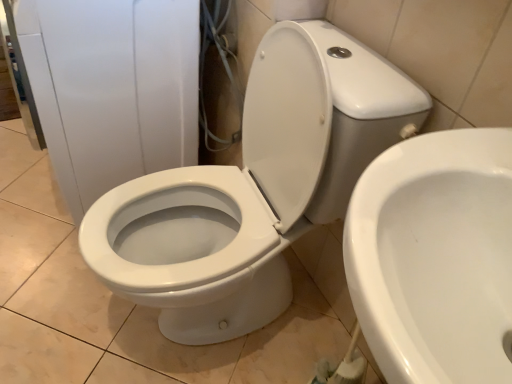
What do you see at coordinates (253, 187) in the screenshot? I see `white glossy toilet at center, which is the 2th toilet from right to left` at bounding box center [253, 187].

How much space does white glossy toilet at center, which ranks as the second toilet in left-to-right order, occupy horizontally?

It is 17.57 inches.

Looking at this image, measure the distance between white glossy toilet at center and camera.

The depth of white glossy toilet at center is 33.75 inches.

Where is `white glossy toilet at center, arranged as the first toilet when viewed from the left`? Image resolution: width=512 pixels, height=384 pixels. white glossy toilet at center, arranged as the first toilet when viewed from the left is located at coordinates (253, 187).

Is point (375, 318) positioned in front of point (173, 290)?

Yes.

Is white glossy toilet at center, the first toilet viewed from the right, to the left or to the right of white glossy toilet at center, which is the 2th toilet from right to left, in the image?

Based on their positions, white glossy toilet at center, the first toilet viewed from the right, is located to the right of white glossy toilet at center, which is the 2th toilet from right to left.

Is white glossy toilet at center, the first toilet viewed from the right, in front of white glossy toilet at center, arranged as the first toilet when viewed from the left?

Yes, it is in front of white glossy toilet at center, arranged as the first toilet when viewed from the left.

Which of these two, white glossy toilet at center, which is the 2th toilet from right to left, or white glossy toilet at center, stands taller?

Standing taller between the two is white glossy toilet at center, which is the 2th toilet from right to left.

Measure the distance from white glossy toilet at center, which is the 2th toilet from right to left, to white glossy toilet at center.

white glossy toilet at center, which is the 2th toilet from right to left, is 12.55 inches away from white glossy toilet at center.

Is white glossy toilet at center, arranged as the first toilet when viewed from the left, not close to white glossy toilet at center?

No, white glossy toilet at center, arranged as the first toilet when viewed from the left, is not far from white glossy toilet at center.

Is point (129, 210) closer or farther from the camera than point (142, 155)?

Point (129, 210) is closer to the camera than point (142, 155).

Locate an element on the screen. The height and width of the screenshot is (384, 512). porcelain on the left of white glossy toilet at center, which ranks as the second toilet in left-to-right order is located at coordinates (112, 88).

Which is closer to the camera, (97,10) or (493,237)?

Point (97,10).

From the image's perspective, is white glossy toilet at center below white glossy toilet at center, the first toilet viewed from the right?

No, from the image's perspective, white glossy toilet at center is not beneath white glossy toilet at center, the first toilet viewed from the right.

Considering the positions of objects white glossy toilet at center, which is the 2th toilet from right to left, and white glossy toilet at center, which ranks as the second toilet in left-to-right order, in the image provided, who is more to the left, white glossy toilet at center, which is the 2th toilet from right to left, or white glossy toilet at center, which ranks as the second toilet in left-to-right order,?

white glossy toilet at center, which is the 2th toilet from right to left.

Does white glossy toilet at center, arranged as the first toilet when viewed from the left, turn towards white glossy toilet at center, which ranks as the second toilet in left-to-right order?

No.

Looking at this image, in terms of height, does white glossy toilet at center, which is the 2th toilet from right to left, look taller or shorter compared to white glossy toilet at center, which ranks as the second toilet in left-to-right order?

Considering their sizes, white glossy toilet at center, which is the 2th toilet from right to left, has more height than white glossy toilet at center, which ranks as the second toilet in left-to-right order.

Does point (134, 63) lie in front of point (98, 242)?

No, (134, 63) is further to viewer.

Based on the photo, does white glossy toilet at center have a lesser height compared to white glossy toilet at center, arranged as the first toilet when viewed from the left?

Yes.

Do you think white glossy toilet at center is within white glossy toilet at center, which is the 2th toilet from right to left, or outside of it?

white glossy toilet at center is not enclosed by white glossy toilet at center, which is the 2th toilet from right to left.

Would you consider white glossy toilet at center to be distant from white glossy toilet at center, which is the 2th toilet from right to left?

No, white glossy toilet at center is not far away from white glossy toilet at center, which is the 2th toilet from right to left.

Consider the image. Which of these two, white glossy toilet at center, the first toilet viewed from the right, or white glossy toilet at center, stands shorter?

With less height is white glossy toilet at center, the first toilet viewed from the right.

Does white glossy toilet at center, the first toilet viewed from the right, appear on the left side of white glossy toilet at center?

In fact, white glossy toilet at center, the first toilet viewed from the right, is to the right of white glossy toilet at center.

Is white glossy toilet at center, which ranks as the second toilet in left-to-right order, wider or thinner than white glossy toilet at center?

In the image, white glossy toilet at center, which ranks as the second toilet in left-to-right order, appears to be more narrow than white glossy toilet at center.

Considering the points (504, 312) and (80, 94), which point is behind, point (504, 312) or point (80, 94)?

The point (80, 94) is farther.

At what (x,y) coordinates should I click in order to perform the action: click on toilet that appears below the white glossy toilet at center, the first toilet viewed from the right (from a real-world perspective). Please return your answer as a coordinate pair (x, y). Looking at the image, I should click on (253, 187).

Identify the location of the 1st toilet below when counting from the white glossy toilet at center (from the image's perspective). This screenshot has height=384, width=512. (253, 187).

Which object lies further to the anchor point white glossy toilet at center, white glossy toilet at center, which ranks as the second toilet in left-to-right order, or white glossy toilet at center, arranged as the first toilet when viewed from the left?

white glossy toilet at center, which ranks as the second toilet in left-to-right order.

From the image, which object appears to be nearer to white glossy toilet at center, which is the 2th toilet from right to left, white glossy toilet at center or white glossy toilet at center, which ranks as the second toilet in left-to-right order?

white glossy toilet at center is closer to white glossy toilet at center, which is the 2th toilet from right to left.

Which object lies nearer to the anchor point white glossy toilet at center, which ranks as the second toilet in left-to-right order, white glossy toilet at center or white glossy toilet at center, which is the 2th toilet from right to left?

Among the two, white glossy toilet at center, which is the 2th toilet from right to left, is located nearer to white glossy toilet at center, which ranks as the second toilet in left-to-right order.

Based on the photo, from the image, which object appears to be nearer to white glossy toilet at center, which is the 2th toilet from right to left, white glossy toilet at center, the first toilet viewed from the right, or white glossy toilet at center?

Among the two, white glossy toilet at center is located nearer to white glossy toilet at center, which is the 2th toilet from right to left.

When comparing their distances from white glossy toilet at center, which ranks as the second toilet in left-to-right order, does white glossy toilet at center, arranged as the first toilet when viewed from the left, or white glossy toilet at center seem further?

white glossy toilet at center.

Looking at the image, which one is located further to white glossy toilet at center, white glossy toilet at center, arranged as the first toilet when viewed from the left, or white glossy toilet at center, the first toilet viewed from the right?

white glossy toilet at center, the first toilet viewed from the right, is positioned further to the anchor white glossy toilet at center.

Identify the location of toilet between white glossy toilet at center and white glossy toilet at center, the first toilet viewed from the right, in the horizontal direction. (253, 187).